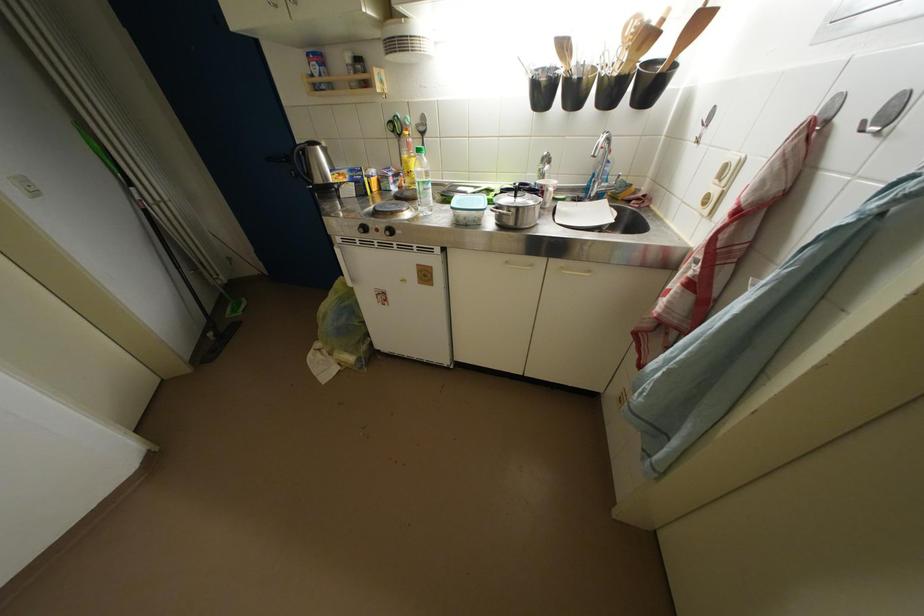
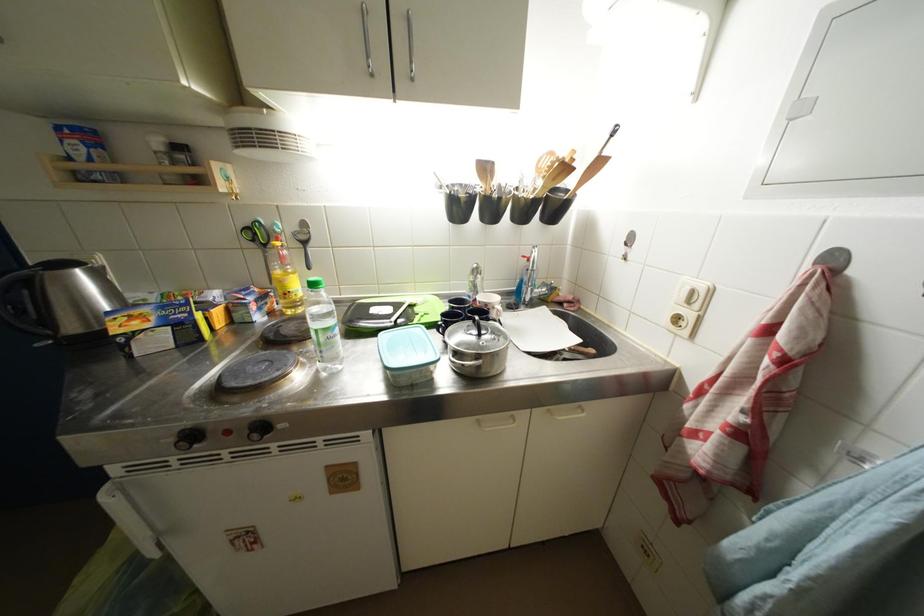
In the second image, find the point that corresponds to [514,265] in the first image.

(485, 424)